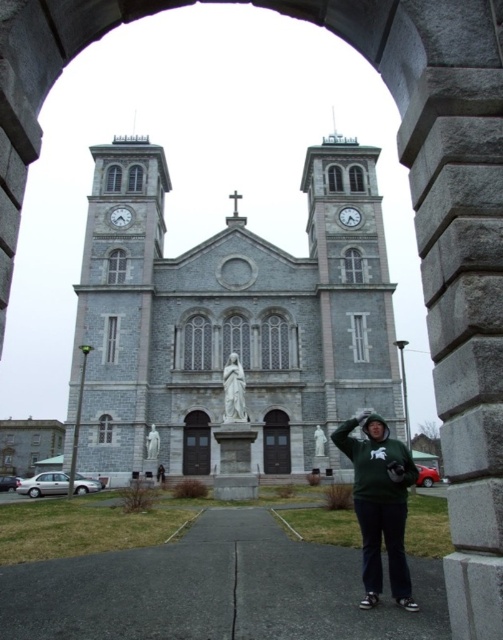
You are a tourist standing on the paved pathway and want to take a photo of the church. You notice the green hoodie at center and the white marble statue at center in your viewfinder. Which object will appear bigger in the photo?

The green hoodie at center will appear bigger in the photo because it has a larger size compared to the white marble statue at center.